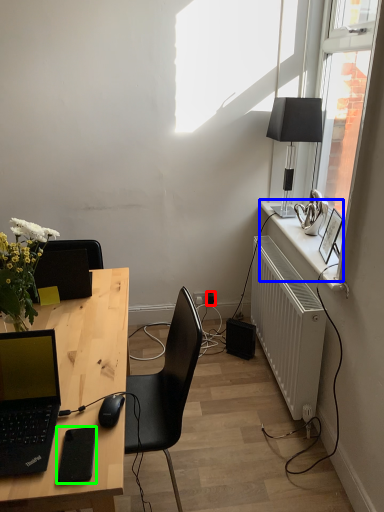
Question: Which is farther away from power outlet (highlighted by a red box)? window sill (highlighted by a blue box) or gadget (highlighted by a green box)?

Choices:
 (A) window sill
 (B) gadget

Answer: (B)